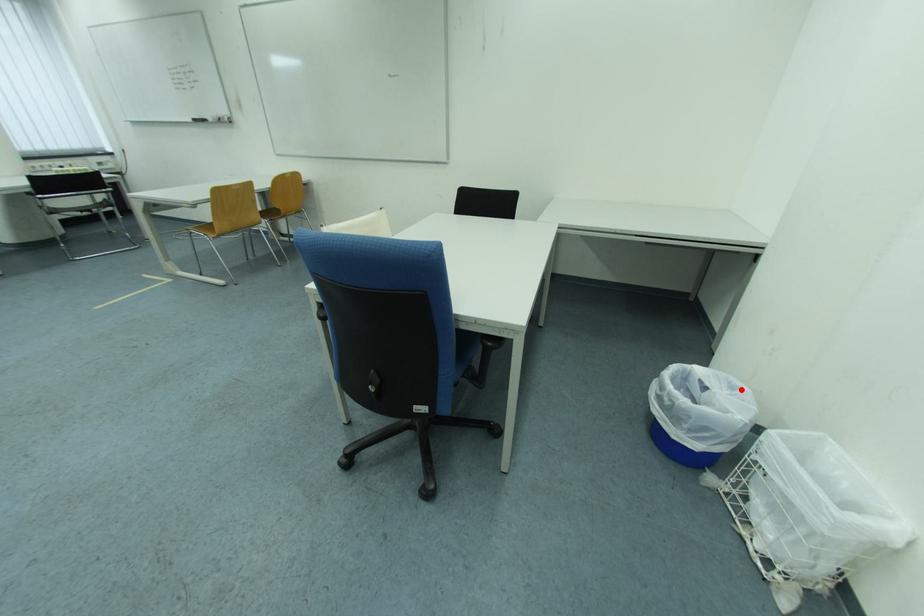
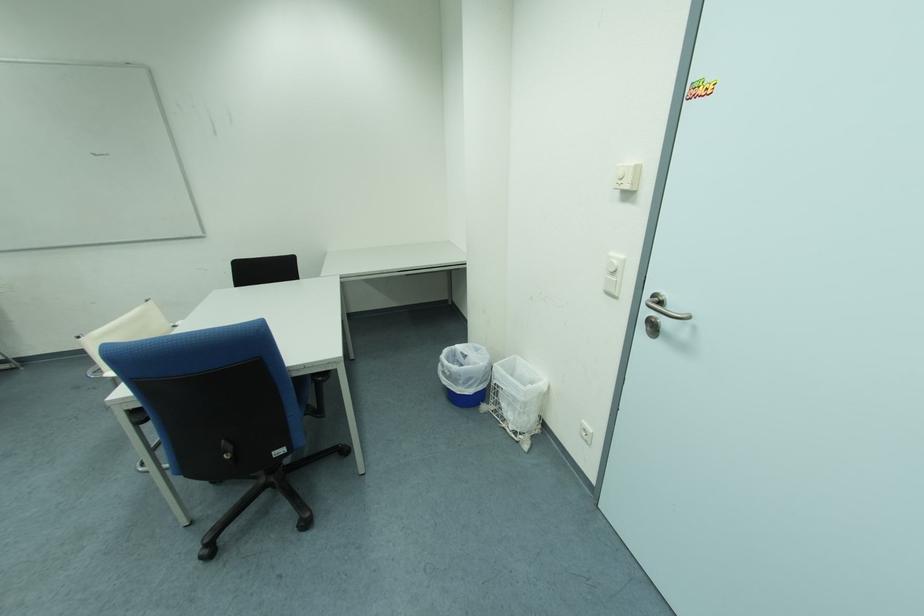
Question: I am providing you with two images of the same scene from different viewpoints. A red point is marked on the first image. At the location where the point appears in image 1, is it still visible in image 2?

Choices:
 (A) Yes
 (B) No

Answer: (A)